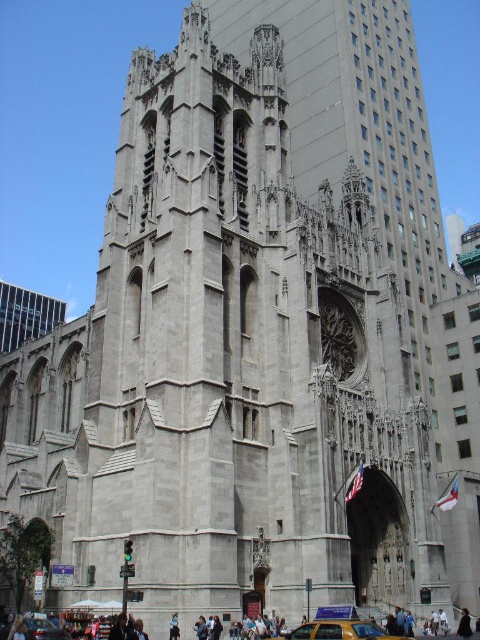
Question: Is yellow matte taxi at lower center smaller than black leather jacket at lower right?

Choices:
 (A) no
 (B) yes

Answer: (A)

Question: Estimate the real-world distances between objects in this image. Which object is closer to the black leather jacket at lower right?

Choices:
 (A) yellow matte taxi at lower center
 (B) yellow metallic taxi cab at lower center

Answer: (A)

Question: Can you confirm if yellow metallic taxi cab at lower center is smaller than black leather jacket at lower right?

Choices:
 (A) yes
 (B) no

Answer: (A)

Question: Which point appears closest to the camera in this image?

Choices:
 (A) (389, 634)
 (B) (466, 620)

Answer: (A)

Question: Does yellow matte taxi at lower center have a smaller size compared to yellow metallic taxi cab at lower center?

Choices:
 (A) yes
 (B) no

Answer: (B)

Question: Which is farther from the black leather jacket at lower right?

Choices:
 (A) yellow matte taxi at lower center
 (B) yellow metallic taxi cab at lower center

Answer: (B)